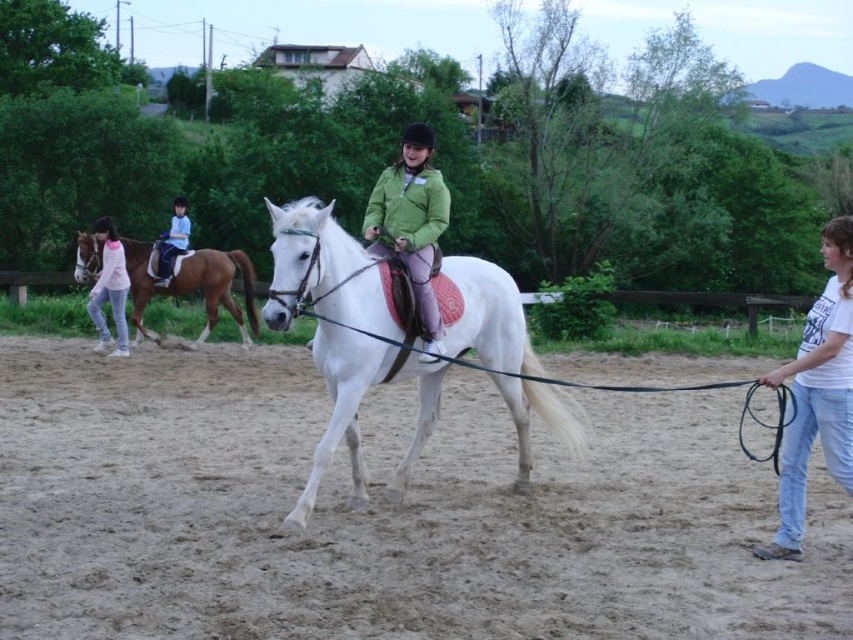
Question: Can you confirm if sandy dirt field at center is positioned to the left of white glossy horse at center?

Choices:
 (A) yes
 (B) no

Answer: (B)

Question: Which object is the closest to the white glossy horse at center?

Choices:
 (A) sandy dirt field at center
 (B) green matte jacket at center
 (C) white cotton shirt at right
 (D) brown glossy horse at left

Answer: (B)

Question: Which object is closer to the camera taking this photo?

Choices:
 (A) brown glossy horse at left
 (B) white cotton shirt at right
 (C) white glossy horse at center
 (D) light blue denim pants at left

Answer: (B)

Question: Which point is farther to the camera?

Choices:
 (A) (416, 186)
 (B) (433, 586)
 (C) (122, 320)

Answer: (C)

Question: Is sandy dirt field at center behind white glossy horse at center?

Choices:
 (A) yes
 (B) no

Answer: (B)

Question: Does white glossy horse at center appear over brown glossy horse at left?

Choices:
 (A) no
 (B) yes

Answer: (A)